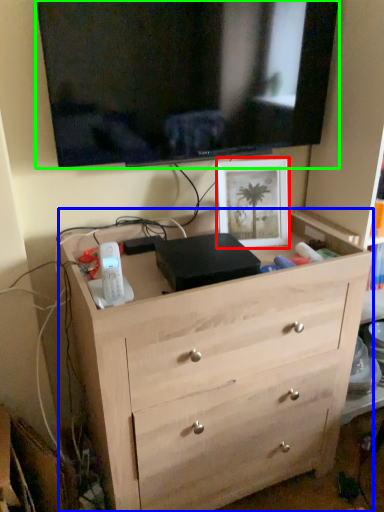
Question: Considering the real-world distances, which object is farthest from picture frame (highlighted by a red box)? chest of drawers (highlighted by a blue box) or television (highlighted by a green box)?

Choices:
 (A) chest of drawers
 (B) television

Answer: (A)